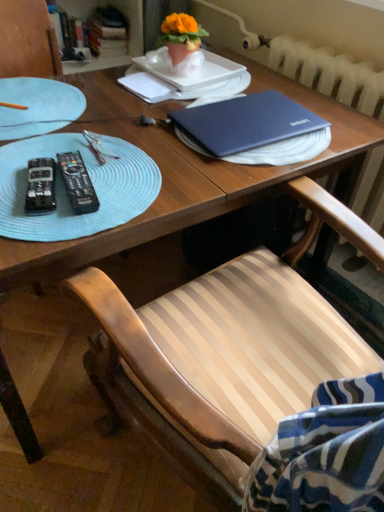
The height and width of the screenshot is (512, 384). I want to click on vacant area that lies between matte blue laptop at center and black plastic remote control at left, the 2th remote control when ordered from right to left, so click(x=146, y=160).